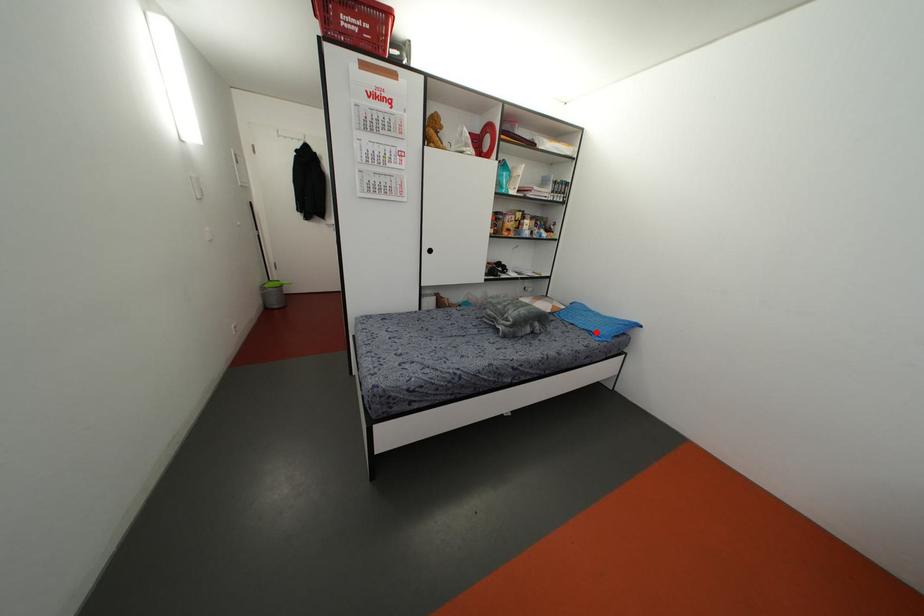
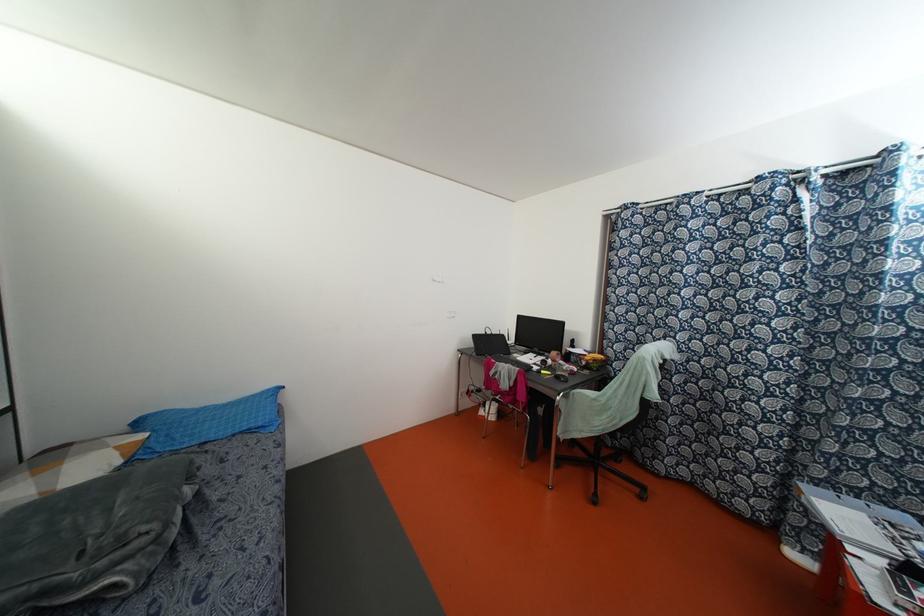
Locate, in the second image, the point that corresponds to the highlighted location in the first image.

(259, 424)